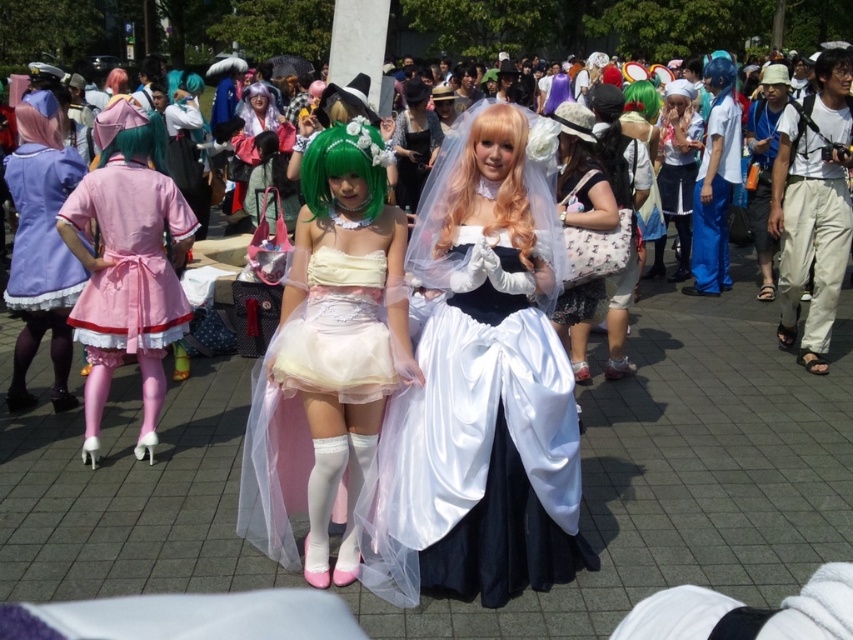
Question: Which object appears farthest from the camera in this image?

Choices:
 (A) pastel satin dress at center
 (B) pink satin dress at left
 (C) matte white tulle dress at center

Answer: (B)

Question: Which object is the closest to the blonde silky wig at center?

Choices:
 (A) white satin dress at center
 (B) pink satin dress at left

Answer: (A)

Question: From the image, what is the correct spatial relationship of matte white tulle dress at center in relation to green matte wig at center?

Choices:
 (A) below
 (B) above

Answer: (A)

Question: Is the position of pink satin dress at left less distant than that of green matte wig at center?

Choices:
 (A) yes
 (B) no

Answer: (B)

Question: Is matte white tulle dress at center to the left of white satin dress at center from the viewer's perspective?

Choices:
 (A) yes
 (B) no

Answer: (A)

Question: Considering the real-world distances, which object is farthest from the matte white dress at center?

Choices:
 (A) blonde silky wig at center
 (B) matte pink dress at left

Answer: (B)